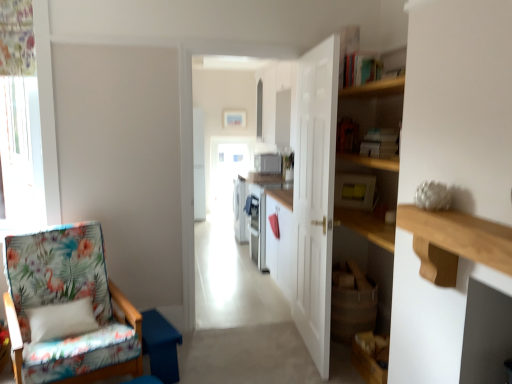
Describe the element at coordinates (454, 242) in the screenshot. Image resolution: width=512 pixels, height=384 pixels. I see `wooden at right` at that location.

Describe the element at coordinates (354, 191) in the screenshot. The width and height of the screenshot is (512, 384). I see `yellow plastic microwave at upper center, placed as the second appliance when sorted from top to bottom` at that location.

Locate an element on the screen. The image size is (512, 384). floral fabric chair at left is located at coordinates (67, 301).

What do you see at coordinates (268, 163) in the screenshot?
I see `white glossy microwave at center, which is the 2th appliance from right to left` at bounding box center [268, 163].

Where is `white wooden door at center`? white wooden door at center is located at coordinates (314, 195).

Is point (93, 231) less distant than point (314, 124)?

No.

In the image, is floral fabric chair at left positioned in front of or behind white wooden door at center?

Clearly, floral fabric chair at left is in front of white wooden door at center.

Would you consider floral fabric chair at left to be distant from white wooden door at center?

Absolutely, floral fabric chair at left is distant from white wooden door at center.

Considering the sizes of objects floral fabric chair at left and white wooden door at center in the image provided, who is shorter, floral fabric chair at left or white wooden door at center?

With less height is floral fabric chair at left.

From a real-world perspective, is wooden at right on top of white glossy microwave at center, the 2th appliance in the front-to-back sequence?

Yes, from a real-world perspective, wooden at right is over white glossy microwave at center, the 2th appliance in the front-to-back sequence

I want to click on appliance beneath the wooden at right (from a real-world perspective), so click(x=268, y=163).

Considering the sizes of objects wooden at right and white glossy microwave at center, which is the 1th appliance in left-to-right order, in the image provided, who is bigger, wooden at right or white glossy microwave at center, which is the 1th appliance in left-to-right order,?

With larger size is white glossy microwave at center, which is the 1th appliance in left-to-right order.

Is wooden at right in contact with white glossy microwave at center, arranged as the 1th appliance when viewed from the back?

They are not placed beside each other.

Considering the sizes of white glossy microwave at center and white glossy microwave at center, the 2th appliance positioned from the bottom, in the image, is white glossy microwave at center wider or thinner than white glossy microwave at center, the 2th appliance positioned from the bottom,?

Clearly, white glossy microwave at center has less width compared to white glossy microwave at center, the 2th appliance positioned from the bottom.

Is white glossy microwave at center, which is the 2th appliance from right to left, a part of white glossy microwave at center?

No.

From the picture: From the image's perspective, relative to white glossy microwave at center, the 2th appliance in the front-to-back sequence, is white glossy microwave at center above or below?

Based on their image positions, white glossy microwave at center is located beneath white glossy microwave at center, the 2th appliance in the front-to-back sequence.

Identify the location of corridor above the white glossy microwave at center, the 2th appliance positioned from the bottom (from a real-world perspective). (241, 109).

In the scene shown: Does white wooden door at center have a larger size compared to white glossy microwave at center?

Yes.

Which of these two, white wooden door at center or white glossy microwave at center, is wider?

Wider between the two is white wooden door at center.

What's the angular difference between white wooden door at center and white glossy microwave at center's facing directions?

95 degrees separate the facing orientations of white wooden door at center and white glossy microwave at center.

In the image, is white wooden door at center on the left side or the right side of white glossy microwave at center?

white wooden door at center is to the right of white glossy microwave at center.

Can you confirm if floral fabric chair at left is taller than yellow plastic microwave at upper center, placed as the second appliance when sorted from top to bottom?

Yes, floral fabric chair at left is taller than yellow plastic microwave at upper center, placed as the second appliance when sorted from top to bottom.

Is the depth of floral fabric chair at left less than that of yellow plastic microwave at upper center, the first appliance in the right-to-left sequence?

Yes, floral fabric chair at left is closer to the camera.

Choose the correct answer: Is floral fabric chair at left inside yellow plastic microwave at upper center, the 1th appliance positioned from the front, or outside it?

floral fabric chair at left lies outside yellow plastic microwave at upper center, the 1th appliance positioned from the front.

Is floral fabric chair at left not near yellow plastic microwave at upper center, the 1th appliance positioned from the front?

Yes, floral fabric chair at left and yellow plastic microwave at upper center, the 1th appliance positioned from the front, are quite far apart.

Can you confirm if white glossy microwave at center is taller than white wooden door at center?

Yes, white glossy microwave at center is taller than white wooden door at center.

Is white glossy microwave at center far away from white wooden door at center?

white glossy microwave at center is far away from white wooden door at center.

Which of these two, white glossy microwave at center or white wooden door at center, is thinner?

Thinner between the two is white glossy microwave at center.

Could white wooden door at center be considered to be inside yellow plastic microwave at upper center, placed as the second appliance when sorted from top to bottom?

No.

Is yellow plastic microwave at upper center, which is counted as the first appliance, starting from the bottom, turned away from white wooden door at center?

No.

From the image's perspective, does yellow plastic microwave at upper center, placed as the second appliance when sorted from top to bottom, appear lower than white wooden door at center?

No, from the image's perspective, yellow plastic microwave at upper center, placed as the second appliance when sorted from top to bottom, is not beneath white wooden door at center.

Between yellow plastic microwave at upper center, the first appliance in the right-to-left sequence, and white wooden door at center, which one appears on the right side from the viewer's perspective?

From the viewer's perspective, yellow plastic microwave at upper center, the first appliance in the right-to-left sequence, appears more on the right side.

Find the location of a particular element. Image resolution: width=512 pixels, height=384 pixels. chair that is in front of the white wooden door at center is located at coordinates (67, 301).

Where is `the 2nd appliance to the left of the wooden at right, counting from the anchor's position`? the 2nd appliance to the left of the wooden at right, counting from the anchor's position is located at coordinates (268, 163).

Based on the photo, from the image, which object appears to be farther from white wooden door at center, white glossy microwave at center, which is the 1th appliance in top-to-bottom order, or yellow plastic microwave at upper center, which is the second appliance from back to front?

Based on the image, white glossy microwave at center, which is the 1th appliance in top-to-bottom order, appears to be further to white wooden door at center.

When comparing their distances from yellow plastic microwave at upper center, which is the second appliance from back to front, does white glossy microwave at center or wooden at right seem closer?

Among the two, wooden at right is located nearer to yellow plastic microwave at upper center, which is the second appliance from back to front.

Estimate the real-world distances between objects in this image. Which object is further from white glossy microwave at center, yellow plastic microwave at upper center, which is the second appliance from back to front, or floral fabric chair at left?

floral fabric chair at left.

In the scene shown: Considering their positions, is white glossy microwave at center, the 2th appliance positioned from the bottom, positioned closer to white glossy microwave at center than yellow plastic microwave at upper center, placed as the second appliance when sorted from top to bottom?

white glossy microwave at center, the 2th appliance positioned from the bottom, is positioned closer to the anchor white glossy microwave at center.

Which object lies further to the anchor point white glossy microwave at center, wooden at right or yellow plastic microwave at upper center, placed as the second appliance when sorted from top to bottom?

wooden at right is further to white glossy microwave at center.

Estimate the real-world distances between objects in this image. Which object is closer to white wooden door at center, white glossy microwave at center or floral fabric chair at left?

floral fabric chair at left is positioned closer to the anchor white wooden door at center.

When comparing their distances from wooden at right, does white glossy microwave at center or floral fabric chair at left seem closer?

floral fabric chair at left is positioned closer to the anchor wooden at right.

Based on their spatial positions, is wooden at right or white wooden door at center further from yellow plastic microwave at upper center, placed as the second appliance when sorted from top to bottom?

wooden at right is further to yellow plastic microwave at upper center, placed as the second appliance when sorted from top to bottom.

You are a GUI agent. You are given a task and a screenshot of the screen. Output one action in this format:
    pyautogui.click(x=<x>, y=<y>)
    Task: Click on the door between floral fabric chair at left and white glossy microwave at center, which is the 2th appliance from right to left, in the front-back direction
    This screenshot has height=384, width=512.
    Given the screenshot: What is the action you would take?
    pyautogui.click(x=314, y=195)

In order to click on corridor positioned between floral fabric chair at left and white glossy microwave at center, which is the 1th appliance in left-to-right order, from near to far in this screenshot , I will do `click(241, 109)`.

You are a GUI agent. You are given a task and a screenshot of the screen. Output one action in this format:
    pyautogui.click(x=<x>, y=<y>)
    Task: Click on the appliance between floral fabric chair at left and white glossy microwave at center, the 2th appliance in the front-to-back sequence, from front to back
    This screenshot has width=512, height=384.
    Given the screenshot: What is the action you would take?
    pyautogui.click(x=354, y=191)

This screenshot has width=512, height=384. Identify the location of door between wooden at right and white glossy microwave at center, which is the 1th appliance in left-to-right order, in the front-back direction. (314, 195).